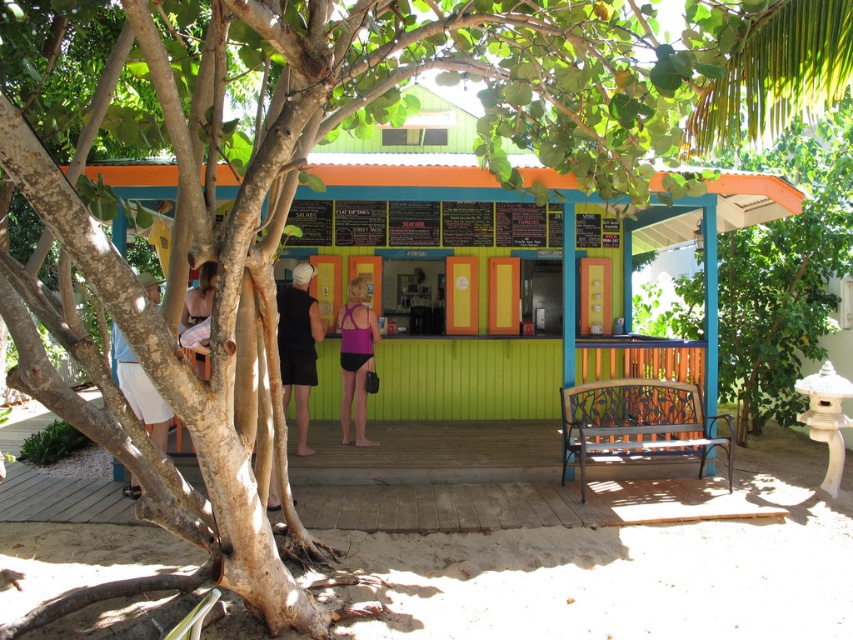
Can you confirm if black sleeveless shirt at center is taller than white fabric skirt at lower left?

Correct, black sleeveless shirt at center is much taller as white fabric skirt at lower left.

Who is positioned more to the right, black sleeveless shirt at center or white fabric skirt at lower left?

black sleeveless shirt at center is more to the right.

Where is `black sleeveless shirt at center`? black sleeveless shirt at center is located at coordinates (299, 346).

Locate an element on the screen. Image resolution: width=853 pixels, height=640 pixels. black sleeveless shirt at center is located at coordinates (299, 346).

Is point (354, 442) farther from camera compared to point (148, 388)?

Yes.

Can you confirm if pink matte swimsuit at center is positioned to the left of white fabric skirt at lower left?

No, pink matte swimsuit at center is not to the left of white fabric skirt at lower left.

Where is `pink matte swimsuit at center`? pink matte swimsuit at center is located at coordinates (355, 358).

Can you confirm if black sleeveless shirt at center is bigger than pink matte swimsuit at center?

Actually, black sleeveless shirt at center might be smaller than pink matte swimsuit at center.

Who is more distant from viewer, (308, 454) or (373, 324)?

Point (373, 324)

At what (x,y) coordinates should I click in order to perform the action: click on black sleeveless shirt at center. Please return your answer as a coordinate pair (x, y). Looking at the image, I should click on (299, 346).